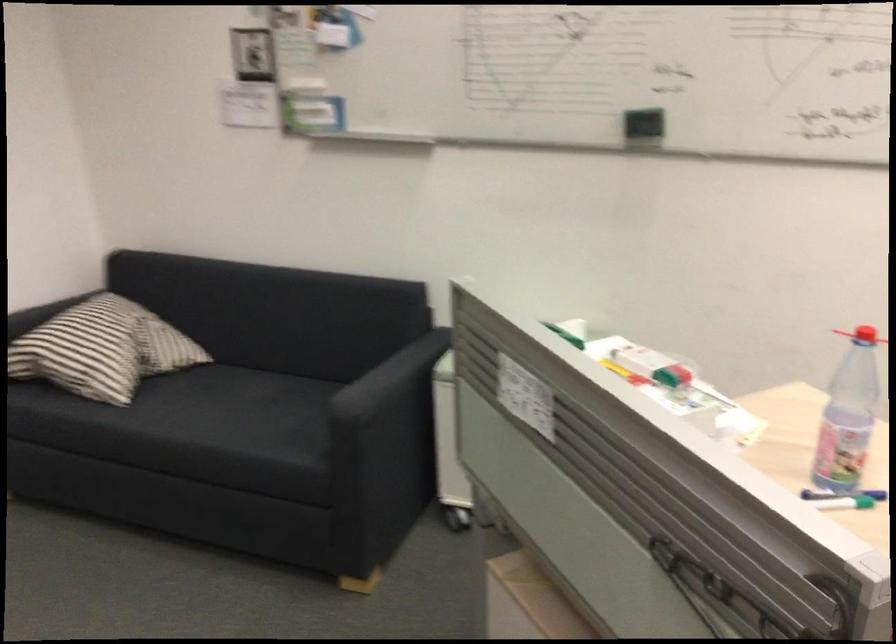
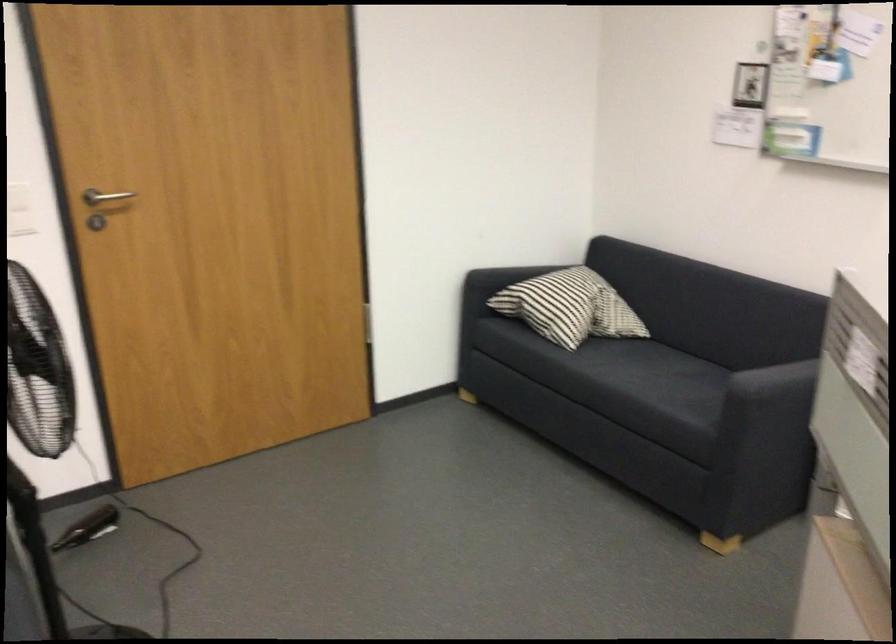
Where in the second image is the point corresponding to (x=108, y=355) from the first image?

(570, 307)